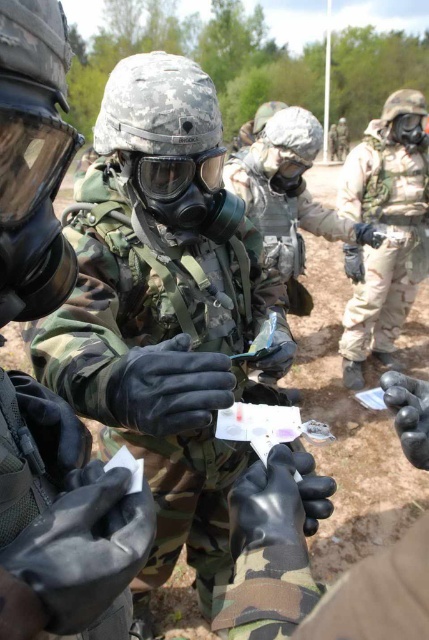
Who is positioned more to the right, camouflage fabric gas mask at center or camouflage uniform at center?

From the viewer's perspective, camouflage uniform at center appears more on the right side.

Between point (105, 291) and point (365, 316), which one is positioned behind?

Point (365, 316)

Identify the location of camouflage fabric gas mask at center. The image size is (429, 640). (163, 308).

Between matte black gas mask at center and camouflage uniform at center, which one has more height?

With more height is camouflage uniform at center.

Measure the distance between matte black gas mask at center and camouflage uniform at center.

matte black gas mask at center and camouflage uniform at center are 9.52 feet apart.

Where is `matte black gas mask at center`? matte black gas mask at center is located at coordinates (63, 522).

Can you confirm if camouflage fabric gas mask at center is smaller than matte black gas mask at center?

Incorrect, camouflage fabric gas mask at center is not smaller in size than matte black gas mask at center.

Does camouflage fabric gas mask at center appear under matte black gas mask at center?

Correct, camouflage fabric gas mask at center is located below matte black gas mask at center.

Does point (103, 433) come in front of point (75, 477)?

No.

Locate an element on the screen. Image resolution: width=429 pixels, height=640 pixels. camouflage fabric gas mask at center is located at coordinates (163, 308).